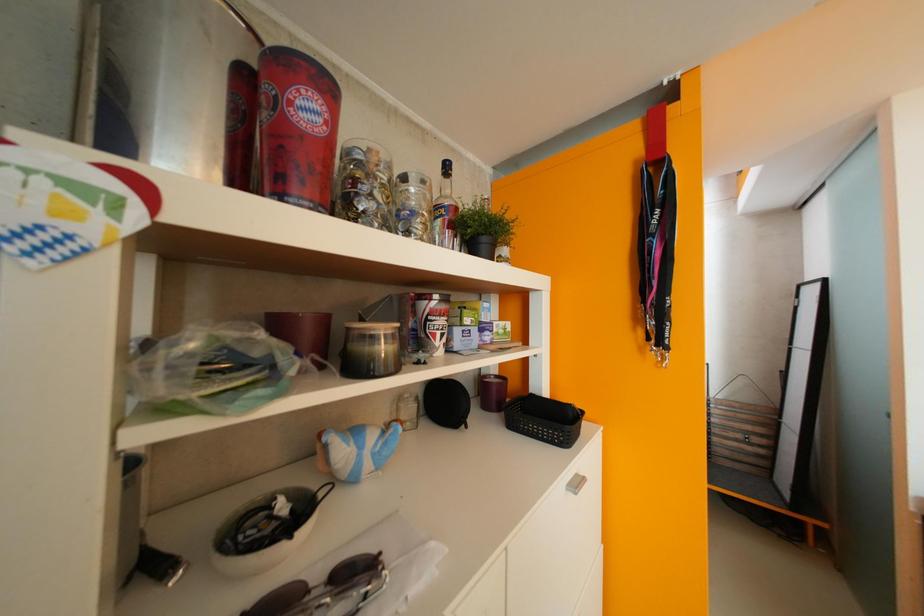
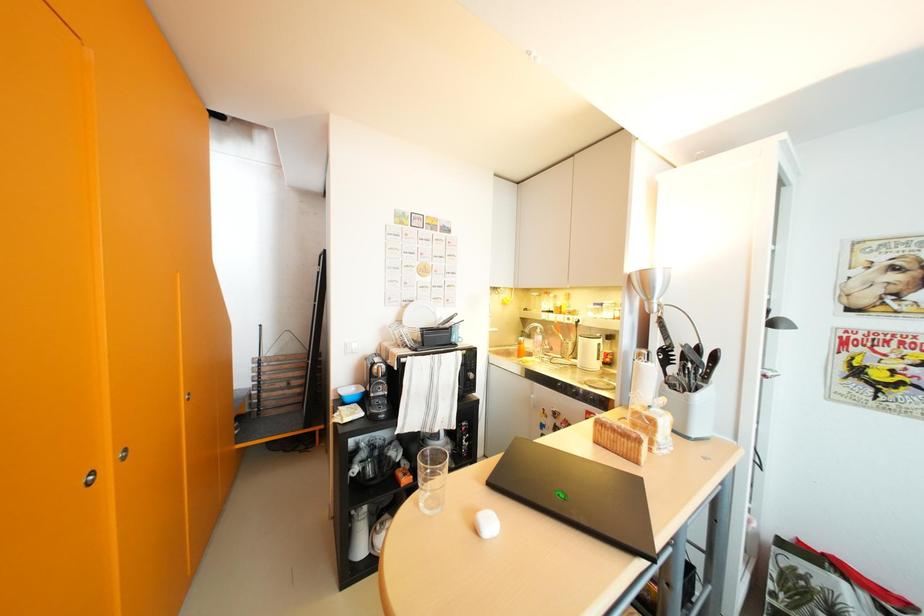
Question: The images are taken continuously from a first-person perspective. In which direction is your viewpoint rotating?

Choices:
 (A) Left
 (B) Right
 (C) Up
 (D) Down

Answer: (B)